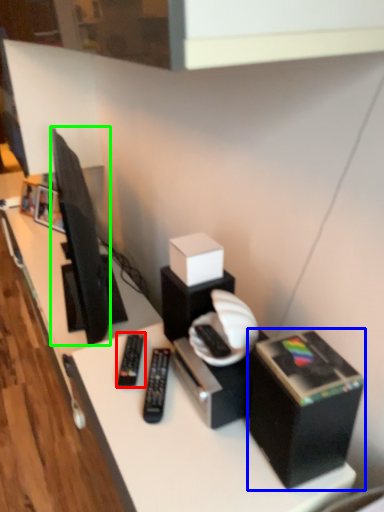
Question: Which is farther away from equipment (highlighted by a red box)? box (highlighted by a blue box) or television (highlighted by a green box)?

Choices:
 (A) box
 (B) television

Answer: (B)